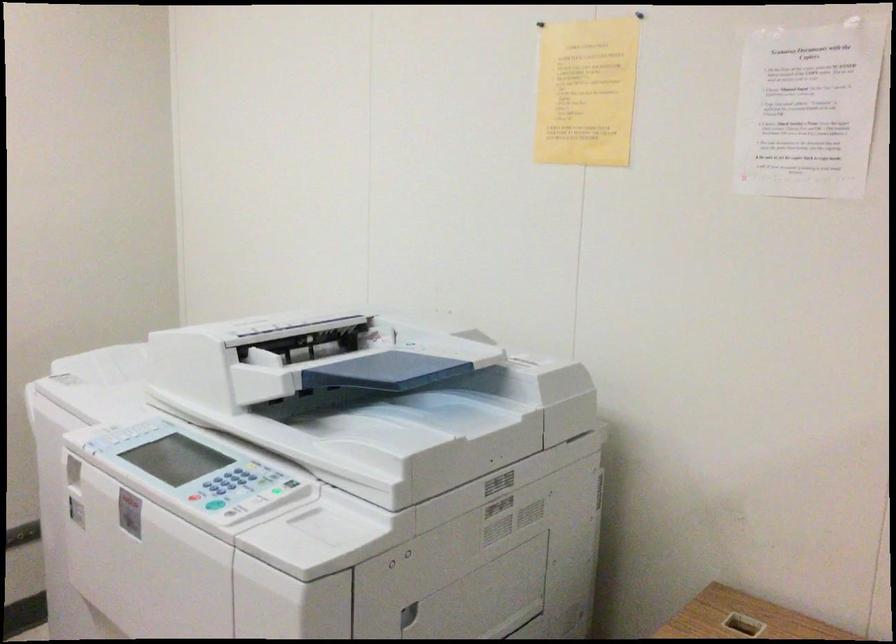
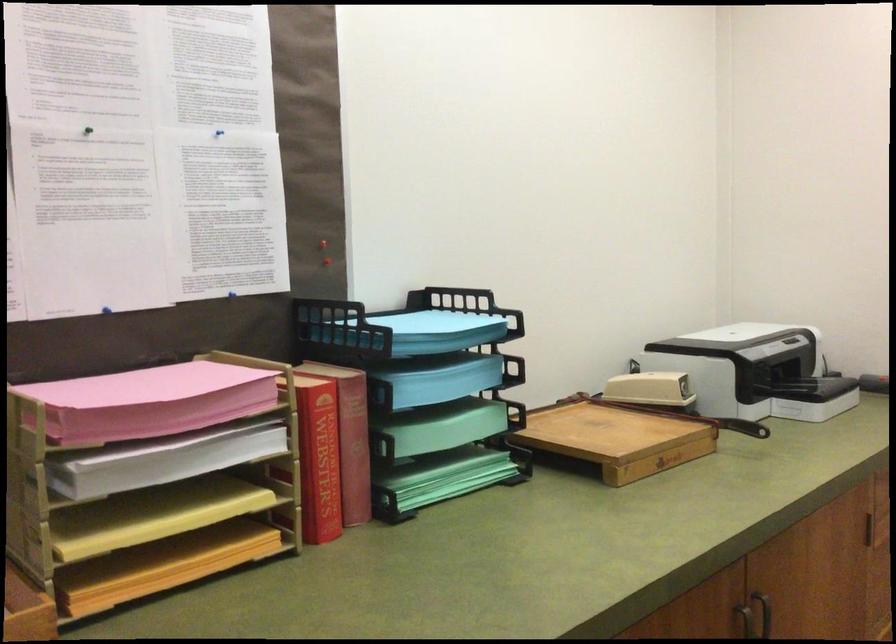
Question: How did the camera likely rotate?

Choices:
 (A) Left
 (B) Right
 (C) Up
 (D) Down

Answer: (A)